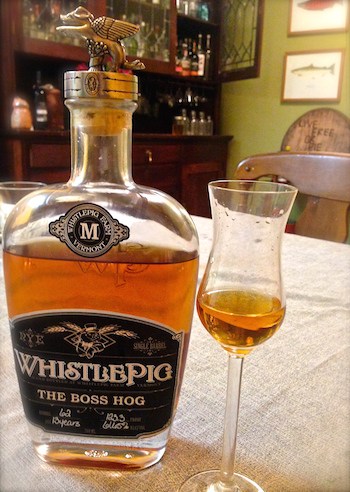
At what (x,y) coordinates should I click in order to perform the action: click on table cloth. Please return your answer as a coordinate pair (x, y). Looking at the image, I should click on (278, 395), (296, 295).